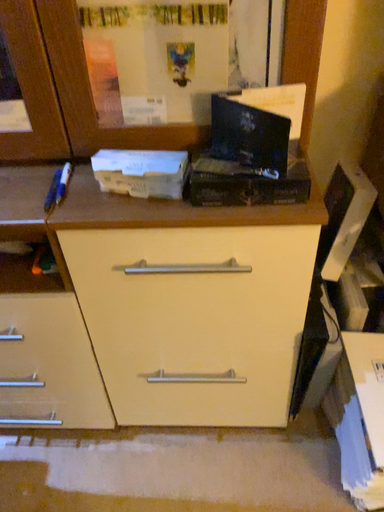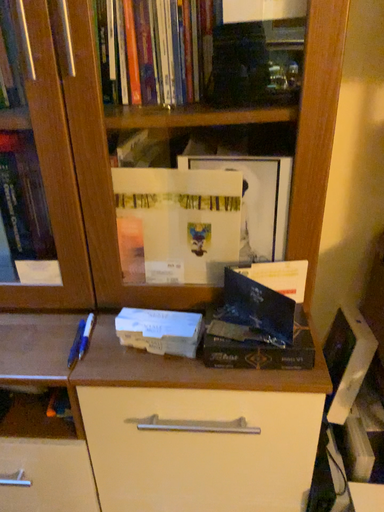
Question: How did the camera likely rotate when shooting the video?

Choices:
 (A) rotated downward
 (B) rotated upward

Answer: (B)